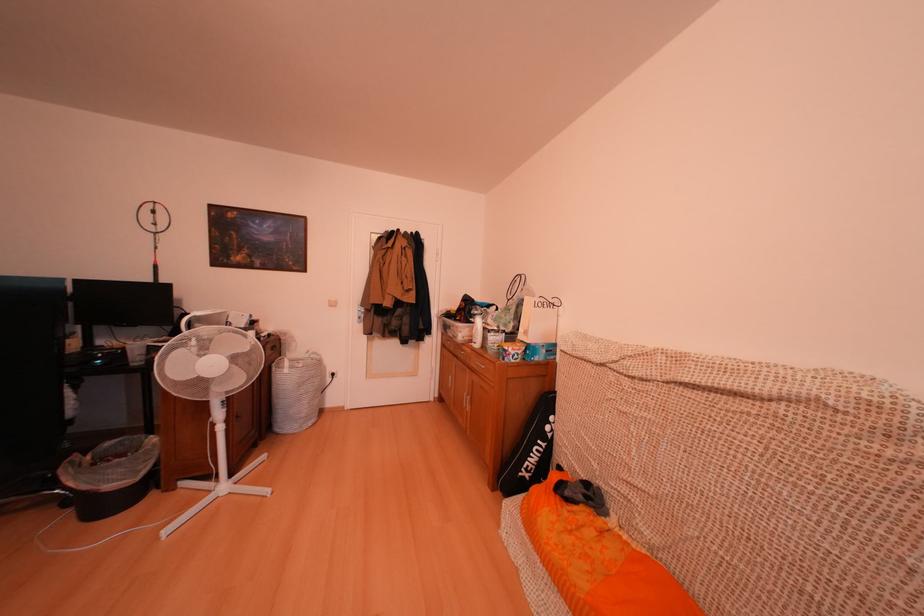
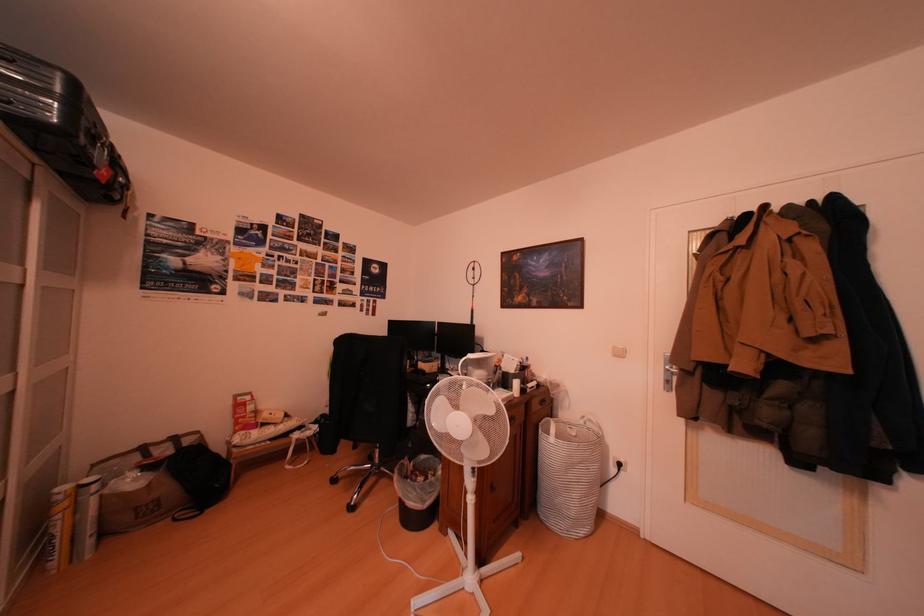
Locate, in the second image, the point that corresponds to (x=286, y=375) in the first image.

(553, 437)